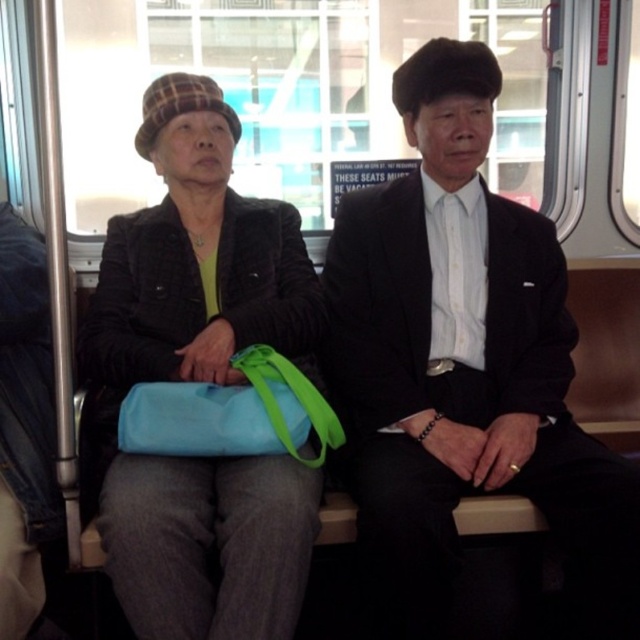
Question: Which point is closer to the camera taking this photo?

Choices:
 (A) (256, 385)
 (B) (368, 228)

Answer: (A)

Question: Does matte black jacket at center have a lesser width compared to blue fabric bag at center?

Choices:
 (A) yes
 (B) no

Answer: (B)

Question: Among these objects, which one is nearest to the camera?

Choices:
 (A) black smooth suit at center
 (B) matte black jacket at center
 (C) blue fabric bag at center

Answer: (B)

Question: Considering the real-world distances, which object is closest to the black smooth suit at center?

Choices:
 (A) blue fabric bag at center
 (B) matte black jacket at center

Answer: (B)

Question: Observing the image, what is the correct spatial positioning of black smooth suit at center in reference to blue fabric bag at center?

Choices:
 (A) right
 (B) left

Answer: (A)

Question: In this image, where is black smooth suit at center located relative to matte black jacket at center?

Choices:
 (A) right
 (B) left

Answer: (A)